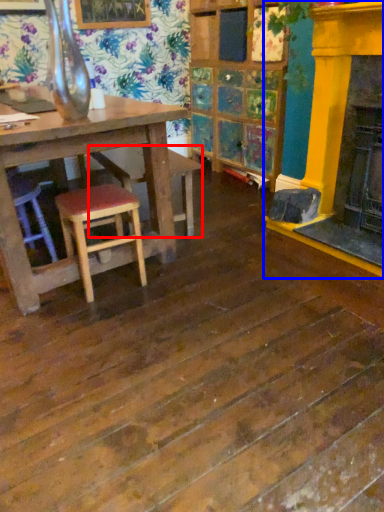
Question: Among these objects, which one is farthest to the camera, bar stool (highlighted by a red box) or fireplace (highlighted by a blue box)?

Choices:
 (A) bar stool
 (B) fireplace

Answer: (A)